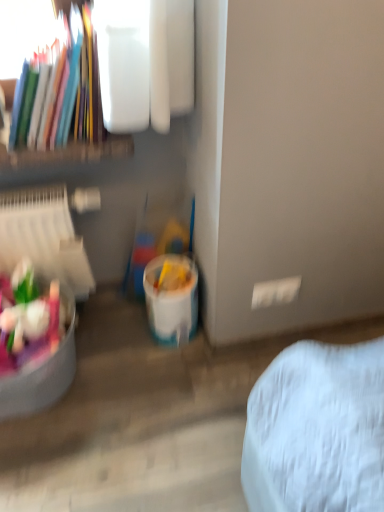
I want to click on unoccupied area in front of white plastic bucket at lower center, so click(173, 371).